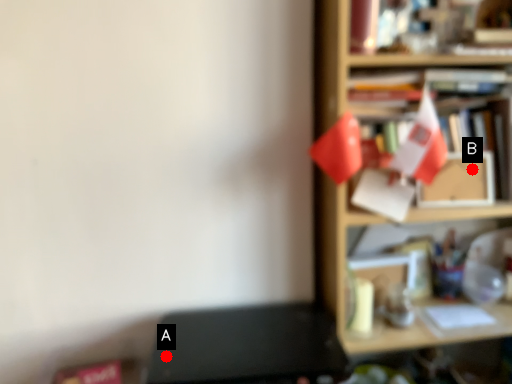
Question: Two points are circled on the image, labeled by A and B beside each circle. Which point is further to the camera?

Choices:
 (A) A is further
 (B) B is further

Answer: (A)